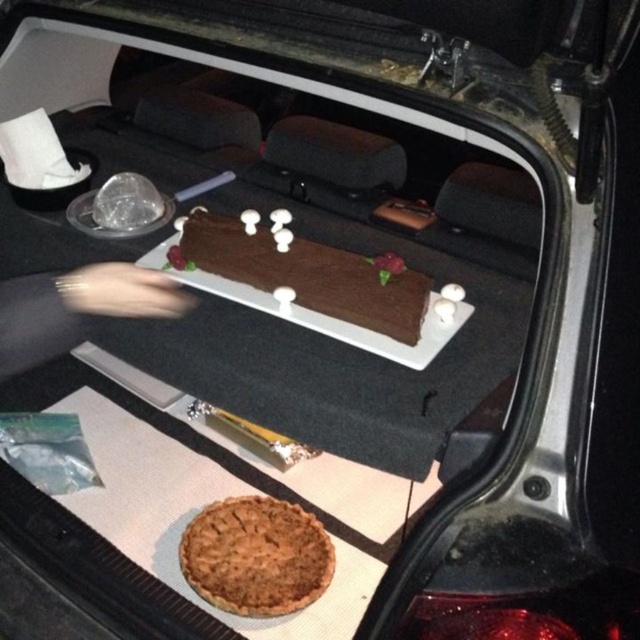
You are standing 1.5 meters away from the car trunk and want to grab the golden brown flaky pie at lower center. Can you reach it without moving closer?

The golden brown flaky pie at lower center is 1.35 meters away from camera. Since you are standing 1.5 meters away from the car trunk, you are 1.5 meters away from the pie, so you cannot reach it without moving closer.

You are helping to load groceries into a car trunk. You have two items to place in the trunk. The golden brown flaky pie at lower center and the chocolate matte at center. Which item is shorter in height?

The golden brown flaky pie at lower center is shorter in height compared to the chocolate matte at center according to the description.

You are packing a picnic basket and need to place the golden brown flaky pie at lower center and the chocolate matte at center into the basket. Which item should you place first to ensure the other fits properly?

You should place the chocolate matte at center first because the golden brown flaky pie at lower center is located below it in the trunk. By placing the lower item first, you can then stack the upper item on top.